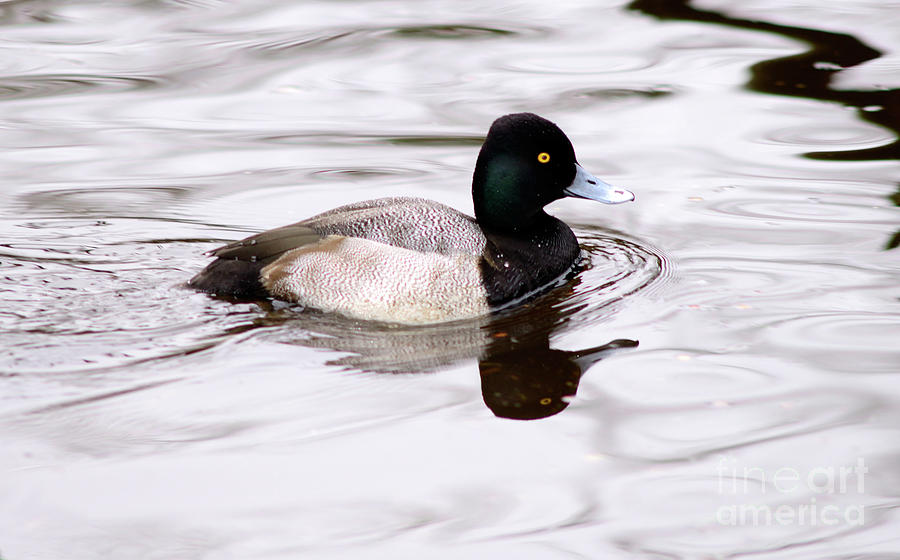
Where is `art`? The width and height of the screenshot is (900, 560). art is located at coordinates (831, 479).